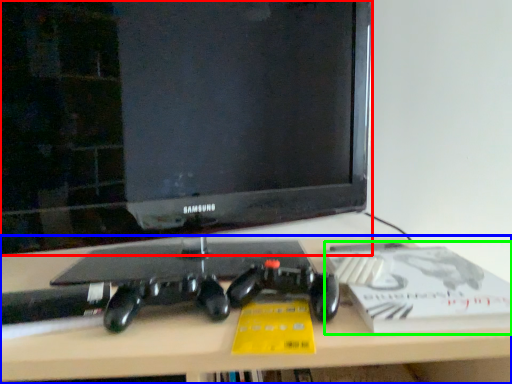
Question: Which is nearer to the television (highlighted by a red box)? desk (highlighted by a blue box) or paperback book (highlighted by a green box).

Choices:
 (A) desk
 (B) paperback book

Answer: (B)